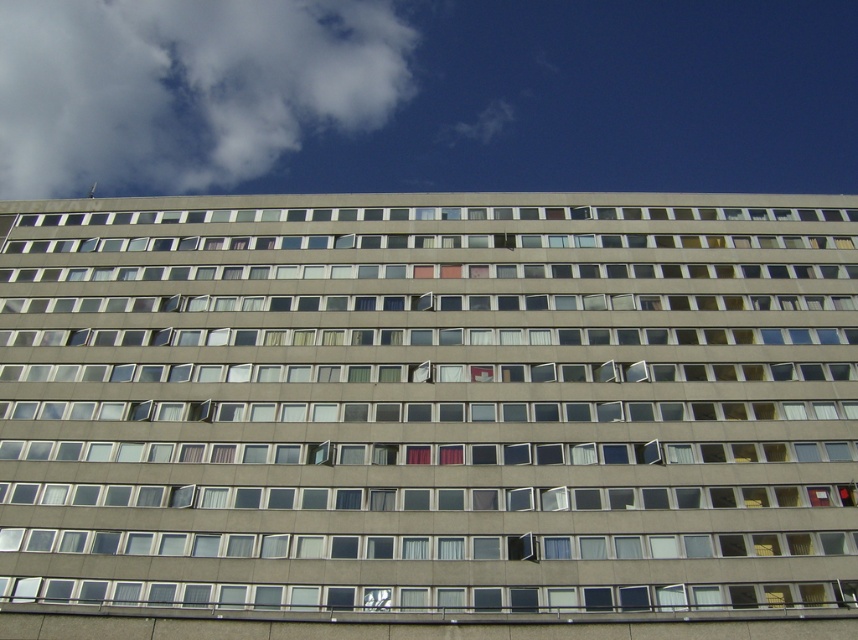
Question: Observing the image, what is the correct spatial positioning of matte gray window at center in reference to white fluffy cloud at upper left?

Choices:
 (A) right
 (B) left

Answer: (A)

Question: Which point appears closest to the camera in this image?

Choices:
 (A) (142, 154)
 (B) (375, 525)

Answer: (B)

Question: Is matte gray window at center closer to the viewer compared to white fluffy cloud at upper left?

Choices:
 (A) yes
 (B) no

Answer: (A)

Question: Is matte gray window at center closer to camera compared to white fluffy cloud at upper left?

Choices:
 (A) yes
 (B) no

Answer: (A)

Question: Which point is closer to the camera?

Choices:
 (A) white fluffy cloud at upper left
 (B) matte gray window at center

Answer: (B)